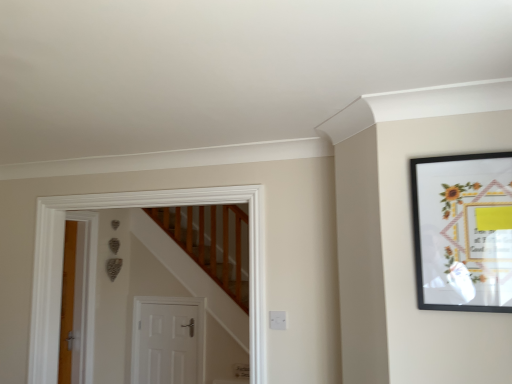
Question: Considering the relative positions of black matte picture frame at upper right and white matte door at center in the image provided, is black matte picture frame at upper right to the right of white matte door at center from the viewer's perspective?

Choices:
 (A) no
 (B) yes

Answer: (B)

Question: Is black matte picture frame at upper right next to white matte door at center?

Choices:
 (A) yes
 (B) no

Answer: (B)

Question: From the image's perspective, is black matte picture frame at upper right on top of white matte door at center?

Choices:
 (A) yes
 (B) no

Answer: (A)

Question: Considering the relative sizes of black matte picture frame at upper right and white matte door at center in the image provided, is black matte picture frame at upper right thinner than white matte door at center?

Choices:
 (A) yes
 (B) no

Answer: (A)

Question: Considering the relative sizes of black matte picture frame at upper right and white matte door at center in the image provided, is black matte picture frame at upper right smaller than white matte door at center?

Choices:
 (A) no
 (B) yes

Answer: (B)

Question: Is black matte picture frame at upper right oriented away from white matte door at center?

Choices:
 (A) no
 (B) yes

Answer: (A)

Question: Is white matte door at center looking in the opposite direction of black matte picture frame at upper right?

Choices:
 (A) no
 (B) yes

Answer: (A)

Question: Is white matte door at center at the right side of black matte picture frame at upper right?

Choices:
 (A) no
 (B) yes

Answer: (A)

Question: From a real-world perspective, is white matte door at center positioned under black matte picture frame at upper right based on gravity?

Choices:
 (A) yes
 (B) no

Answer: (A)

Question: Is white matte door at center in front of black matte picture frame at upper right?

Choices:
 (A) yes
 (B) no

Answer: (B)

Question: Is white matte door at center not inside black matte picture frame at upper right?

Choices:
 (A) no
 (B) yes

Answer: (B)

Question: Considering the relative sizes of white matte door at center and black matte picture frame at upper right in the image provided, is white matte door at center taller than black matte picture frame at upper right?

Choices:
 (A) no
 (B) yes

Answer: (B)

Question: Looking at their shapes, would you say black matte picture frame at upper right is wider or thinner than white matte door at center?

Choices:
 (A) thin
 (B) wide

Answer: (A)